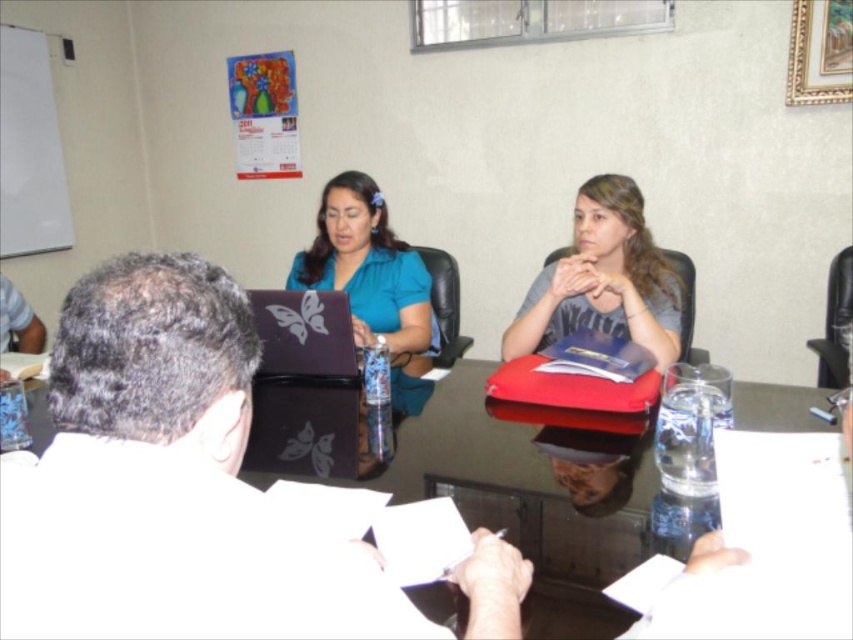
Is matte blue laptop at center wider than matte black laptop at center?

Yes.

Based on the photo, which is more to the left, matte blue laptop at center or matte black laptop at center?

Positioned to the left is matte black laptop at center.

Does point (366, 212) lie in front of point (335, 324)?

No, it is behind (335, 324).

This screenshot has height=640, width=853. In order to click on matte blue laptop at center in this screenshot , I will do `click(368, 268)`.

Who is taller, transparent glass table at center or matte gray folder at center?

matte gray folder at center is taller.

Is point (165, 563) positioned after point (659, 264)?

No, (165, 563) is closer to viewer.

The image size is (853, 640). What are the coordinates of `transparent glass table at center` in the screenshot? It's located at (747, 605).

Is point (809, 596) behind point (252, 301)?

That is False.

Between point (747, 400) and point (318, 330), which one is positioned in front?

Positioned in front is point (747, 400).

At what (x,y) coordinates should I click in order to perform the action: click on transparent glass table at center. Please return your answer as a coordinate pair (x, y). Image resolution: width=853 pixels, height=640 pixels. Looking at the image, I should click on (747, 605).